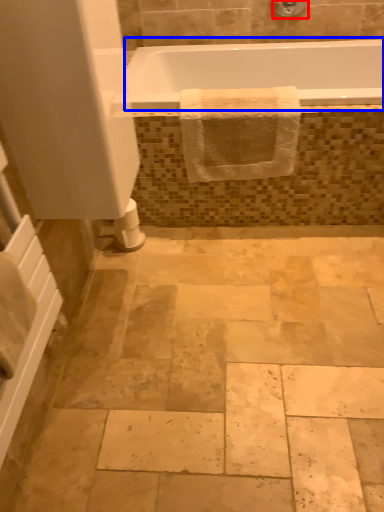
Question: Which object is closer to the camera taking this photo, shower (highlighted by a red box) or bathtub (highlighted by a blue box)?

Choices:
 (A) shower
 (B) bathtub

Answer: (B)